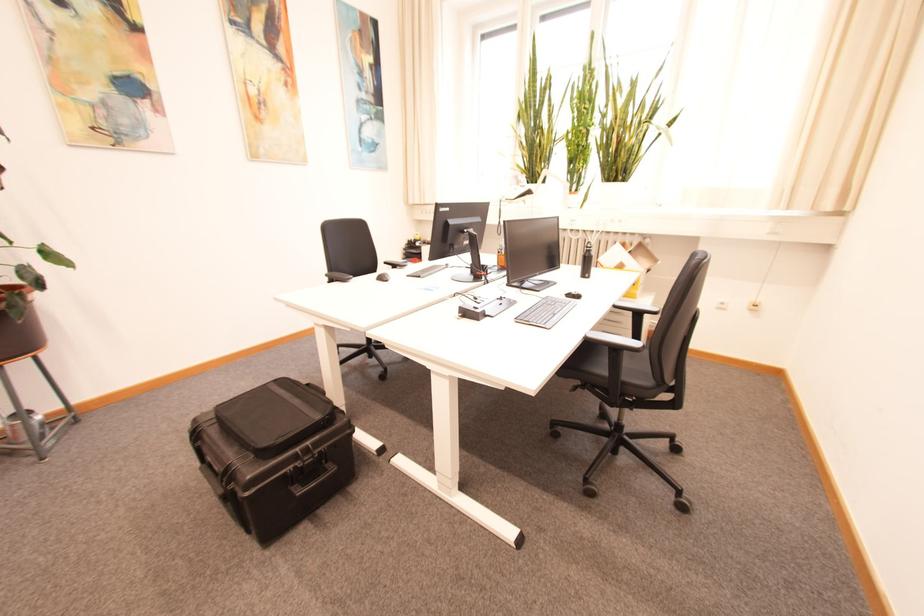
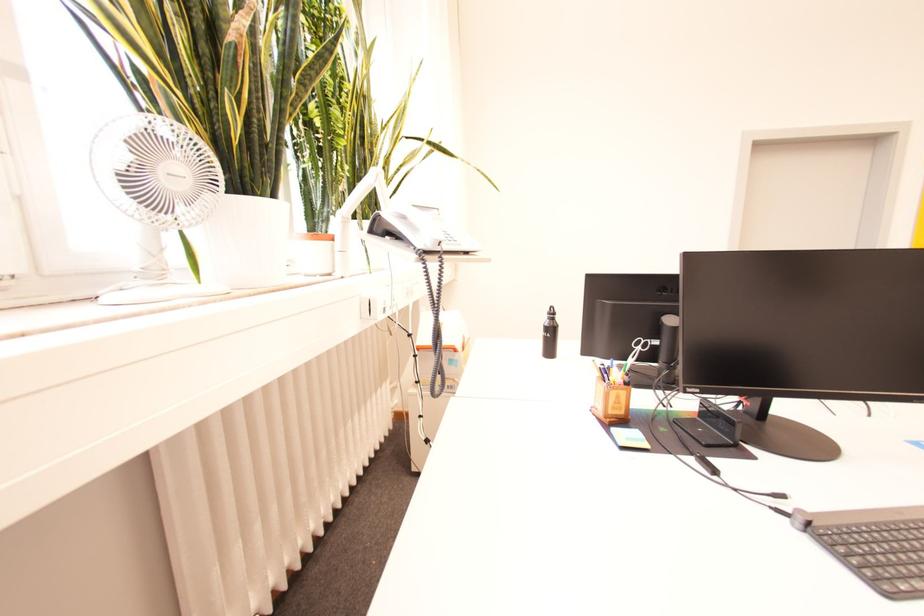
Question: I am providing you with two images of the same scene from different viewpoints. Please identify which objects are invisible in image2.

Choices:
 (A) black keyboard
 (B) black chair armrest
 (C) mattress sitting surface
 (D) black water bottle

Answer: (B)